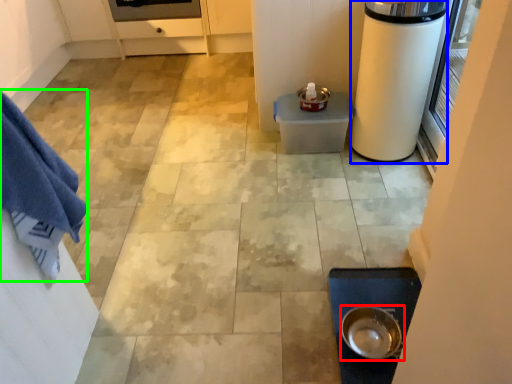
Question: Which object is positioned farthest from kitchen appliance (highlighted by a red box)? Select from appliance (highlighted by a blue box) and bath towel (highlighted by a green box).

Choices:
 (A) appliance
 (B) bath towel

Answer: (B)